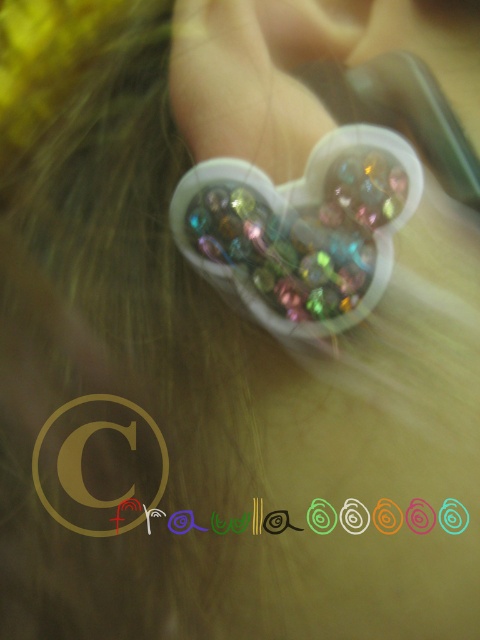
You are a stylist trying to decide how to arrange two hair accessories. You have a shiny plastic heart at center and a pearlized plastic heart at upper center. Which one is wider?

The shiny plastic heart at center is wider than the pearlized plastic heart at upper center.

You are taking a photo of the shiny plastic heart at center. If your camera is 20 inches away from the heart, will you be able to capture the entire accessory in the frame?

The shiny plastic heart at center and camera are 20.82 inches apart. Since your camera is only 20 inches away, you are slightly too close to capture the entire accessory in the frame.